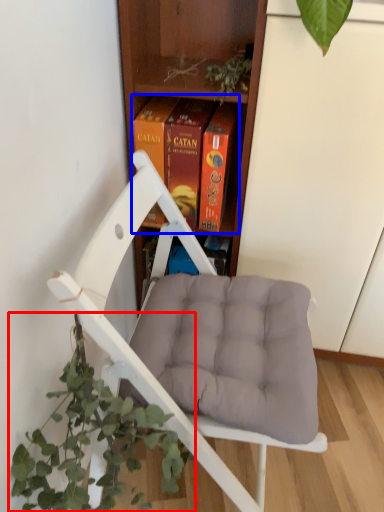
Question: Which object is closer to the camera taking this photo, houseplant (highlighted by a red box) or book (highlighted by a blue box)?

Choices:
 (A) houseplant
 (B) book

Answer: (A)